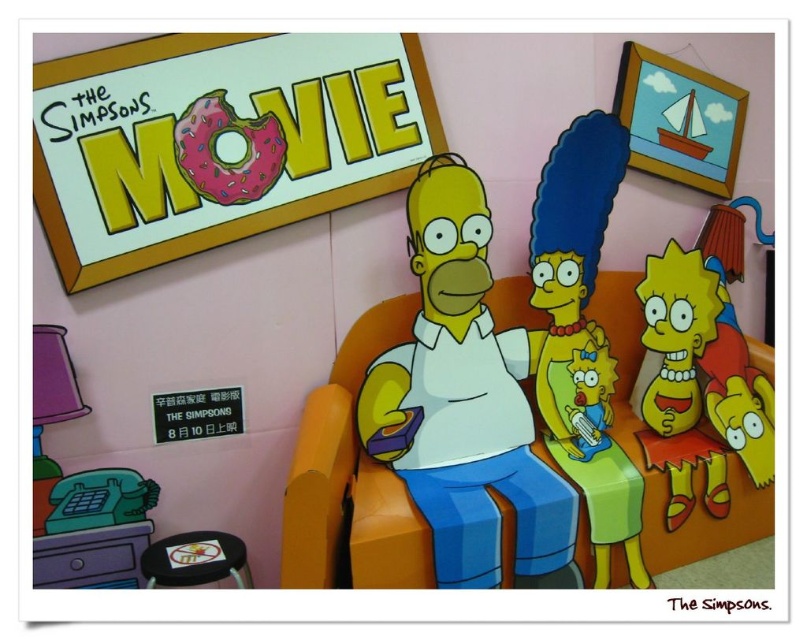
Question: Is blue plastic doll at center further to the viewer compared to pink frosted donut at upper left?

Choices:
 (A) yes
 (B) no

Answer: (A)

Question: Among these points, which one is farthest from the camera?

Choices:
 (A) (475, 300)
 (B) (529, 256)
 (C) (237, 538)
 (D) (247, 196)

Answer: (C)

Question: Can you confirm if yellow matte homer simpson at center is positioned above black rubber stool at lower left?

Choices:
 (A) yes
 (B) no

Answer: (A)

Question: Is yellow matte homer simpson at center below pink frosted donut at upper left?

Choices:
 (A) no
 (B) yes

Answer: (B)

Question: Which point is farther from the camera taking this photo?

Choices:
 (A) [747, 486]
 (B) [258, 176]

Answer: (A)

Question: Which point is closer to the camera?

Choices:
 (A) blue plastic doll at center
 (B) black rubber stool at lower left
 (C) orange matte armchair at center

Answer: (C)